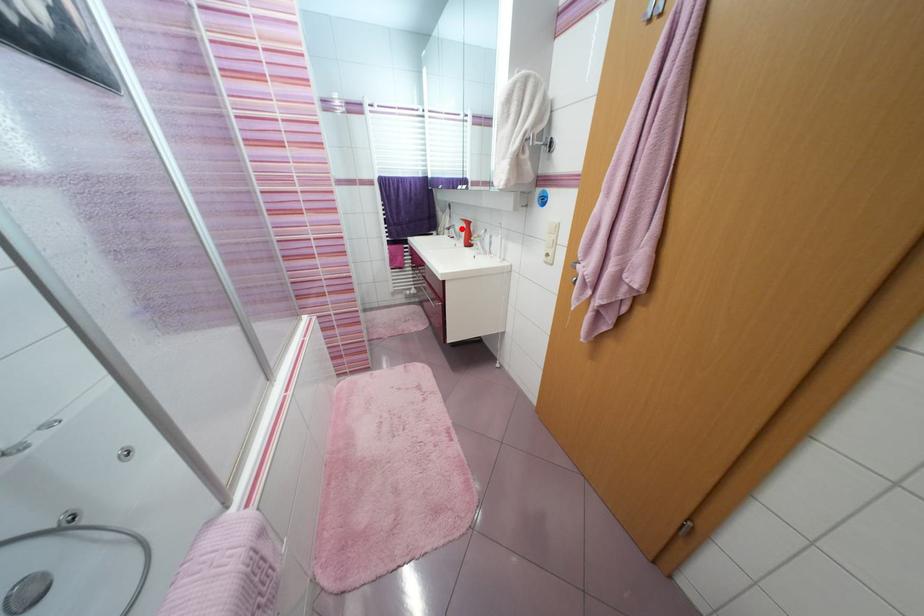
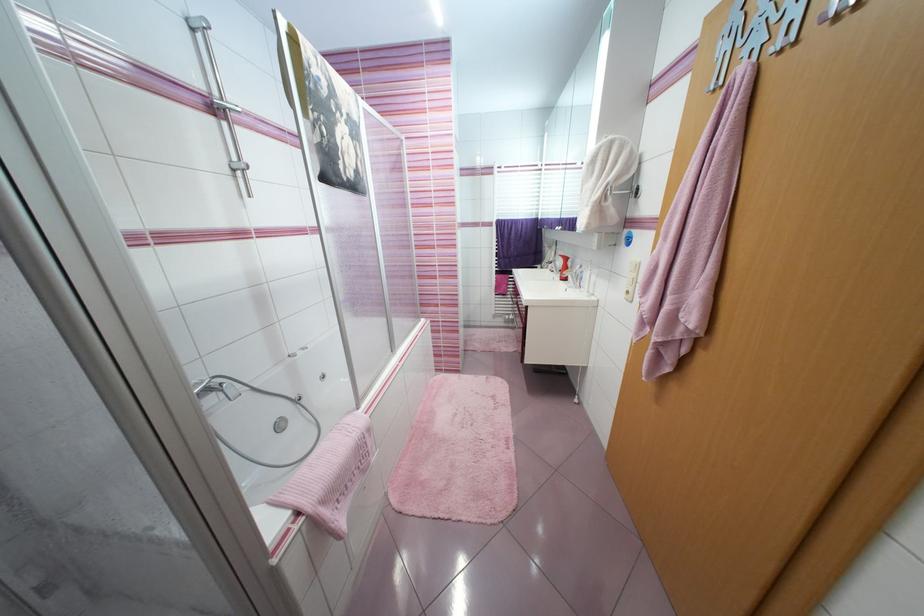
The point at the highlighted location is marked in the first image. Where is the corresponding point in the second image?

(563, 264)